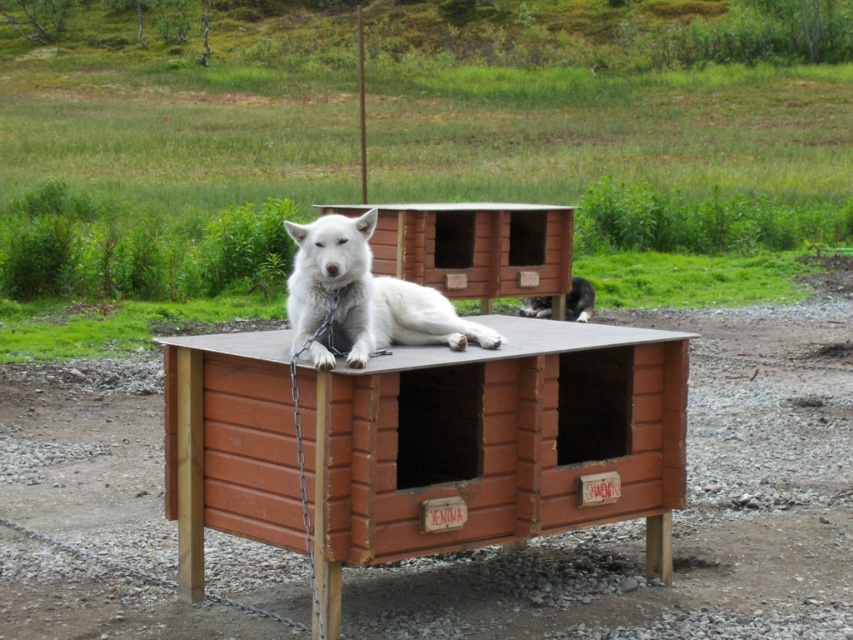
You are setting up a picnic and need to place a blanket on the brown wooden table at center. Since the black fur cat at center is already there, will the table have enough space for both the cat and the blanket?

The brown wooden table at center is larger in size than black fur cat at center, so there should be enough space for both the cat and the blanket.

You are standing in a park and see a white fur dog at center and a black fur cat at center. Which animal is positioned more to the left side?

The white fur dog at center is positioned to the left of the black fur cat at center, so the white fur dog at center is more to the left.